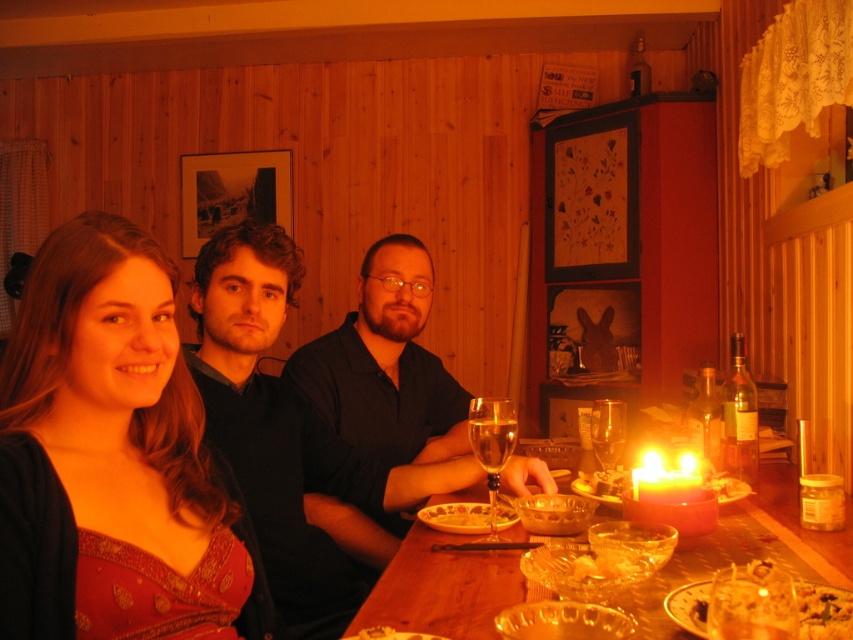
You are a photographer setting up for a group photo in this dining area. You need to ensure that the matte red dress at left and the translucent glass table at center are both visible in the frame. Based on their heights, which object might require you to adjust your camera angle to capture both effectively?

The matte red dress at left has a greater height compared to the translucent glass table at center, so you might need to lower the camera angle to ensure both are fully visible in the frame.

You are a guest at this dinner table and want to place your napkin on the object that is closer to you. Which object should you choose between the matte glass platter at lower right and the translucent glass bowl at table center?

The matte glass platter at lower right is in front of the translucent glass bowl at table center, so it is closer to you. You should place your napkin on the matte glass platter at lower right.